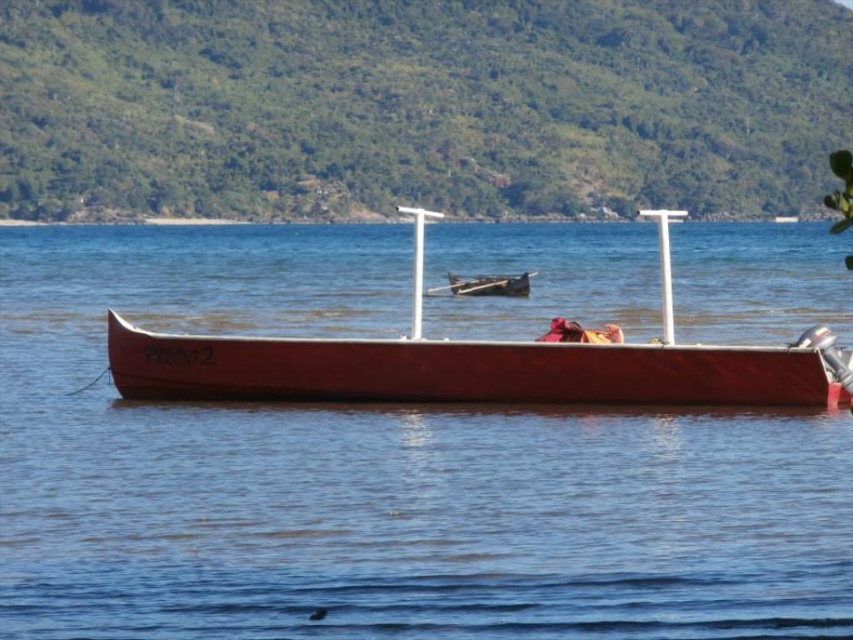
Question: Does smooth water at center have a smaller size compared to smooth wood canoe at center?

Choices:
 (A) no
 (B) yes

Answer: (A)

Question: Based on their relative distances, which object is farther from the smooth red boat at center?

Choices:
 (A) smooth wood canoe at center
 (B) smooth water at center

Answer: (B)

Question: In this image, where is smooth water at center located relative to smooth wood canoe at center?

Choices:
 (A) above
 (B) below

Answer: (A)

Question: From the image, what is the correct spatial relationship of smooth red boat at center in relation to wooden paddle at center?

Choices:
 (A) right
 (B) left

Answer: (A)

Question: Considering the real-world distances, which object is farthest from the smooth wood canoe at center?

Choices:
 (A) smooth water at center
 (B) smooth red boat at center
 (C) wooden paddle at center

Answer: (A)

Question: Which is nearer to the smooth red boat at center?

Choices:
 (A) wooden paddle at center
 (B) smooth water at center
 (C) smooth wood canoe at center

Answer: (C)